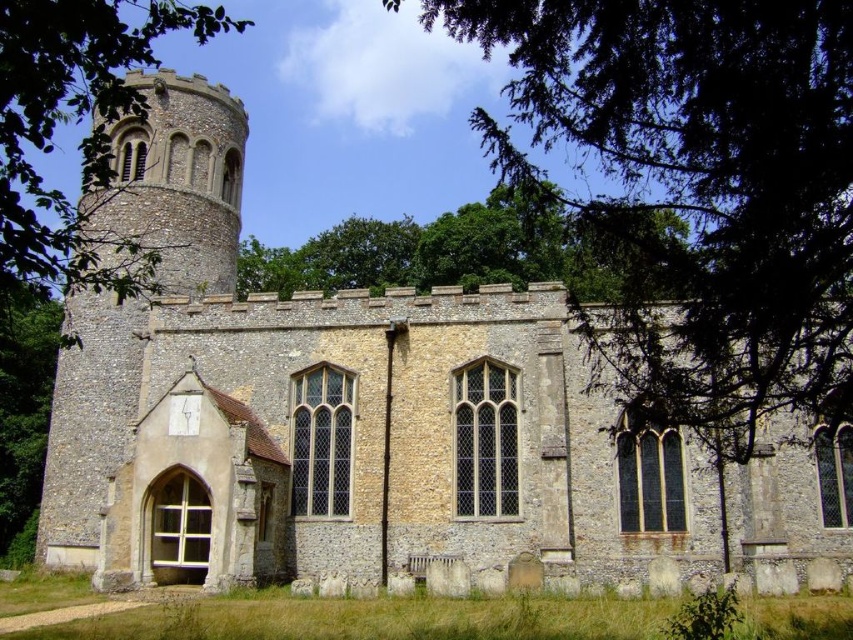
You are standing in front of the historic stone church and notice a specific point marked at coordinates (x=695, y=193). Based on the scene description, can you identify what this point is located on?

The point at coordinates (x=695, y=193) is located on the green leafy tree at upper center.

You are standing at a point 36.91 meters away from the church. You want to take a photo of the church such that the point at coordinates point (811, 332) is centered in the frame. Given that your camera has a maximum zoom range of 50 meters, will you be able to achieve this without moving closer?

The distance of point (811, 332) from viewer is 36.91 meters, which is within the camera maximum zoom range of 50 meters. Therefore, you can achieve this without moving closer.